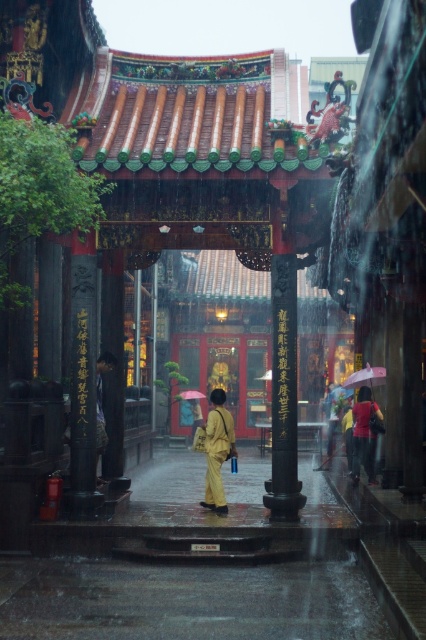
You are a visitor at this temple on a rainy day. You notice a yellow matte dress at center and a red matte umbrella at center. Which item is physically nearer to you as you stand in front of the gate?

The yellow matte dress at center is closer to the viewer than the red matte umbrella at center, so the yellow matte dress at center is physically nearer to you.

You are a visitor holding a yellow fabric umbrella at center and a pink matte umbrella at center. You want to walk towards the ornate gate while keeping the gate in the center of your view. Which umbrella should you hold closer to your body to avoid blocking the view of the gate?

The yellow fabric umbrella at center is to the left of pink matte umbrella at center. To keep the gate centered in your view while walking, hold the yellow fabric umbrella at center closer to your body since it is positioned to the left and might obstruct the central view if not adjusted properly.